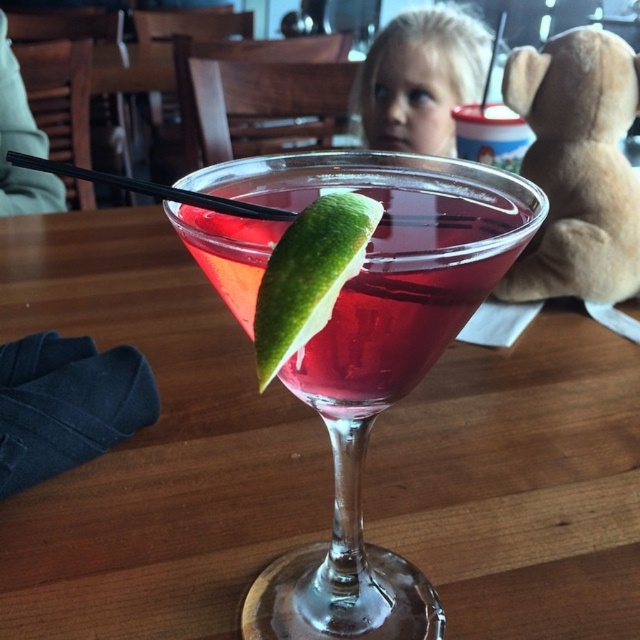
Does translucent glass martini at center appear under translucent glass drink at center?

Yes, translucent glass martini at center is below translucent glass drink at center.

Who is taller, translucent glass martini at center or translucent glass drink at center?

With more height is translucent glass martini at center.

Does point (403, 596) lie behind point (323, 193)?

Yes, it is behind point (323, 193).

Locate an element on the screen. translucent glass martini at center is located at coordinates (376, 358).

Is translucent glass drink at center closer to the viewer compared to green matte lime at center?

No, translucent glass drink at center is behind green matte lime at center.

Which is behind, point (458, 282) or point (275, 291)?

Point (458, 282)

Does point (499, 205) come closer to viewer compared to point (364, 196)?

That is False.

You are a GUI agent. You are given a task and a screenshot of the screen. Output one action in this format:
    pyautogui.click(x=<x>, y=<y>)
    Task: Click on the translucent glass drink at center
    
    Given the screenshot: What is the action you would take?
    pyautogui.click(x=392, y=262)

Is translucent glass martini at center closer to the viewer compared to green matte lime at center?

No, translucent glass martini at center is behind green matte lime at center.

Identify the location of translucent glass martini at center. This screenshot has width=640, height=640. click(376, 358).